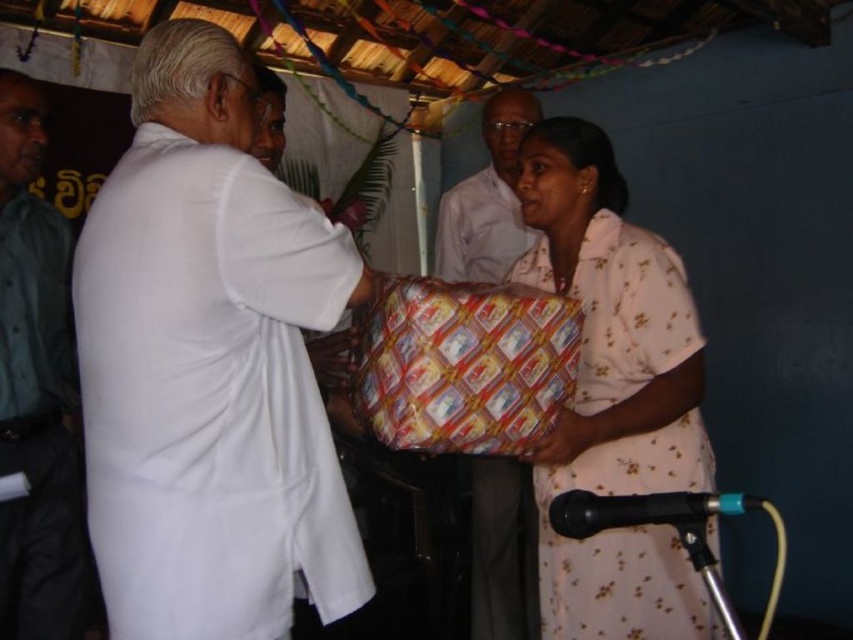
You are a photographer trying to capture the gift exchange between the two people. You notice the white cloth shirt at center and the patterned paper package at center. Which object should you focus on first if you want to ensure both are in frame without moving the camera?

The white cloth shirt at center is taller than the patterned paper package at center, so focusing on the taller object first will ensure both are in frame without needing to adjust the camera angle.

You are standing at the point marked as point [35,387] in the image. What object is located exactly at that point?

The green uniform shirt at left is located exactly at point [35,387].

You are a photographer at a cultural event and need to position a spotlight on the two main subjects, the white cloth shirt at center and the pink floral dress at center. Given that the spotlight can only cover a 1.2 meter diameter area, will both subjects fit within the spotlight if they are positioned side by side?

The white cloth shirt at center has a smaller size compared to pink floral dress at center. However, without specific measurements of their combined width, it is uncertain if they can fit within the 1.2 meter diameter spotlight. Additional information about their actual sizes or distance apart is needed to determine this.